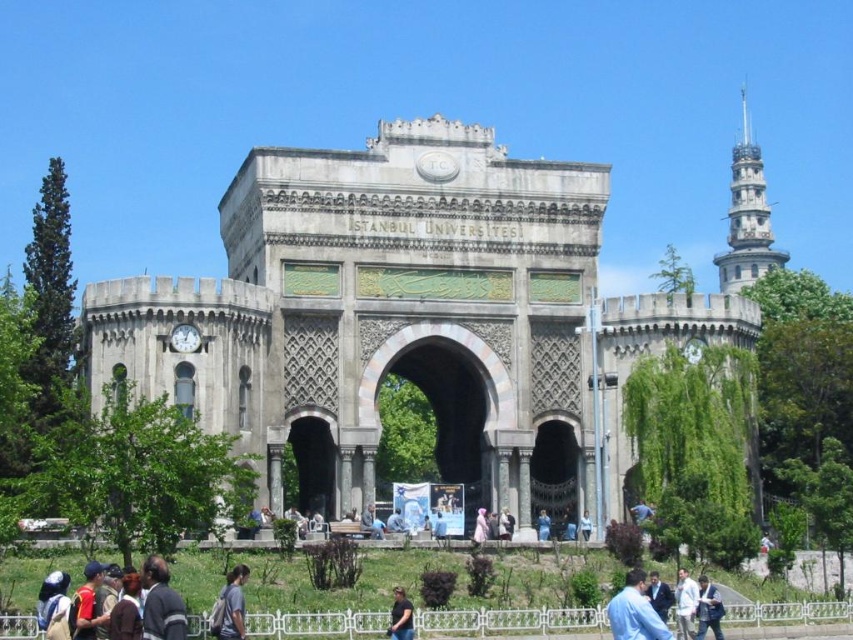
Question: Is blue fabric headscarf at lower left to the left of dark blue shirt at lower center from the viewer's perspective?

Choices:
 (A) yes
 (B) no

Answer: (A)

Question: Can you confirm if dark blue shirt at lower center is wider than light blue fabric jacket at center?

Choices:
 (A) yes
 (B) no

Answer: (A)

Question: Which of the following is the farthest from the observer?

Choices:
 (A) dark blue shirt at center
 (B) blue shirt at lower right

Answer: (A)

Question: Which of the following is the farthest from the observer?

Choices:
 (A) gray fabric at lower center
 (B) white fabric dress at center

Answer: (B)

Question: Can you confirm if gray fabric at lower center is smaller than white fabric dress at center?

Choices:
 (A) yes
 (B) no

Answer: (A)

Question: Which object appears farthest from the camera in this image?

Choices:
 (A) light brown leather jacket at center
 (B) white fabric dress at center

Answer: (A)